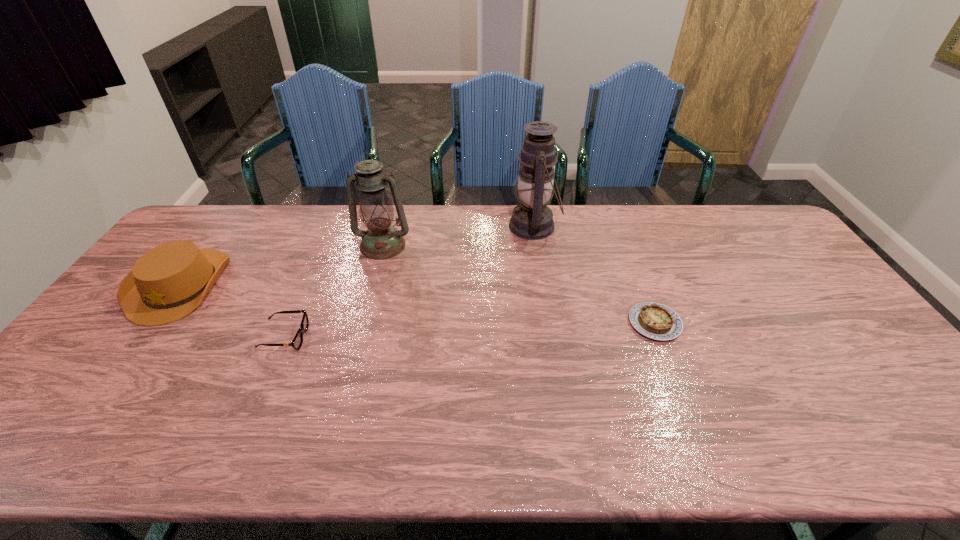
The image size is (960, 540). Find the location of `vacant region located 0.250m on the front of the left oil lamp`. vacant region located 0.250m on the front of the left oil lamp is located at coordinates (364, 316).

You are a GUI agent. You are given a task and a screenshot of the screen. Output one action in this format:
    pyautogui.click(x=<x>, y=<y>)
    Task: Click on the vacant area situated on the front-facing side of the third tallest object
    
    Given the screenshot: What is the action you would take?
    pyautogui.click(x=69, y=435)

Locate an element on the screen. This screenshot has width=960, height=540. vacant space located on the front-facing side of the fourth tallest object is located at coordinates (366, 337).

You are a GUI agent. You are given a task and a screenshot of the screen. Output one action in this format:
    pyautogui.click(x=<x>, y=<y>)
    Task: Click on the vacant space located 0.100m on the front of the quiche
    The height and width of the screenshot is (540, 960).
    Given the screenshot: What is the action you would take?
    pyautogui.click(x=675, y=374)

What are the coordinates of `object situated at the left edge` in the screenshot? It's located at (168, 282).

In the image, there is a desktop. Where is `vacant space at the far edge`? vacant space at the far edge is located at coordinates (336, 244).

In order to click on vacant area at the near edge of the desktop in this screenshot , I will do point(528,451).

Where is `vacant space at the right edge`? Image resolution: width=960 pixels, height=540 pixels. vacant space at the right edge is located at coordinates (848, 383).

Locate an element on the screen. vacant space in between the shortest object and the third object from right to left is located at coordinates (518, 284).

The height and width of the screenshot is (540, 960). I want to click on free space between the right oil lamp and the quiche, so click(594, 275).